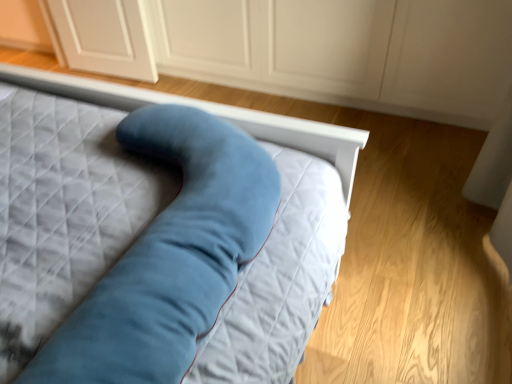
Question: From a real-world perspective, is matte white dresser at center below velvet blue pillow at center?

Choices:
 (A) no
 (B) yes

Answer: (B)

Question: Could you tell me if matte white dresser at center is facing velvet blue pillow at center?

Choices:
 (A) yes
 (B) no

Answer: (A)

Question: Is matte white dresser at center directly adjacent to velvet blue pillow at center?

Choices:
 (A) no
 (B) yes

Answer: (A)

Question: Considering the relative sizes of matte white dresser at center and velvet blue pillow at center in the image provided, is matte white dresser at center wider than velvet blue pillow at center?

Choices:
 (A) no
 (B) yes

Answer: (A)

Question: Is matte white dresser at center thinner than velvet blue pillow at center?

Choices:
 (A) yes
 (B) no

Answer: (A)

Question: Can you confirm if matte white dresser at center is taller than velvet blue pillow at center?

Choices:
 (A) no
 (B) yes

Answer: (B)

Question: Does velvet blue pillow at center have a lesser width compared to matte white dresser at center?

Choices:
 (A) yes
 (B) no

Answer: (B)

Question: Would you say velvet blue pillow at center contains matte white dresser at center?

Choices:
 (A) yes
 (B) no

Answer: (B)

Question: Is velvet blue pillow at center located outside matte white dresser at center?

Choices:
 (A) yes
 (B) no

Answer: (A)

Question: Is velvet blue pillow at center smaller than matte white dresser at center?

Choices:
 (A) yes
 (B) no

Answer: (A)

Question: Is velvet blue pillow at center positioned with its back to matte white dresser at center?

Choices:
 (A) yes
 (B) no

Answer: (B)

Question: Does velvet blue pillow at center come in front of matte white dresser at center?

Choices:
 (A) no
 (B) yes

Answer: (B)

Question: From the image's perspective, relative to velvet blue pillow at center, is matte white dresser at center above or below?

Choices:
 (A) above
 (B) below

Answer: (A)